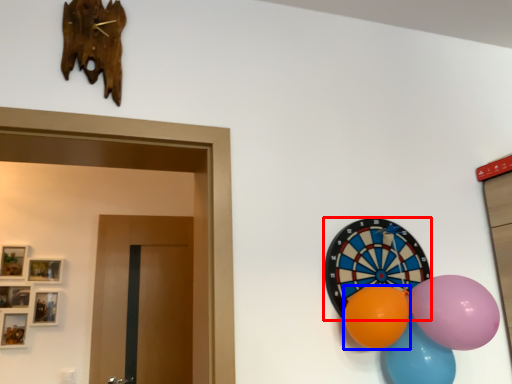
Question: Which of the following is the farthest to the observer, oval (highlighted by a red box) or balloon (highlighted by a blue box)?

Choices:
 (A) oval
 (B) balloon

Answer: (A)